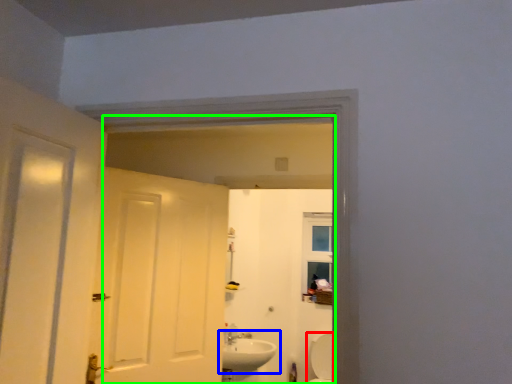
Question: Which object is positioned farthest from bath (highlighted by a red box)? Select from sink (highlighted by a blue box) and mirror (highlighted by a green box).

Choices:
 (A) sink
 (B) mirror

Answer: (A)